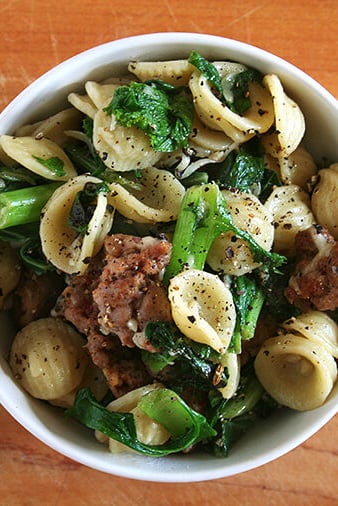
This screenshot has width=338, height=506. I want to click on wood laminate tabletop under bowl, so click(53, 34).